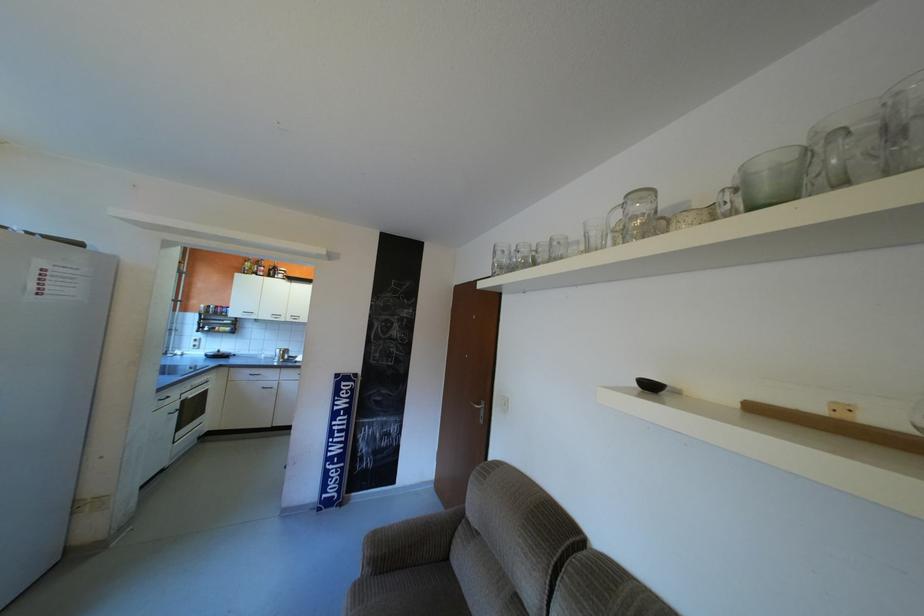
Find where to rest the sofa armrest. Please return your answer as a coordinate pair (x, y).

(416, 533)